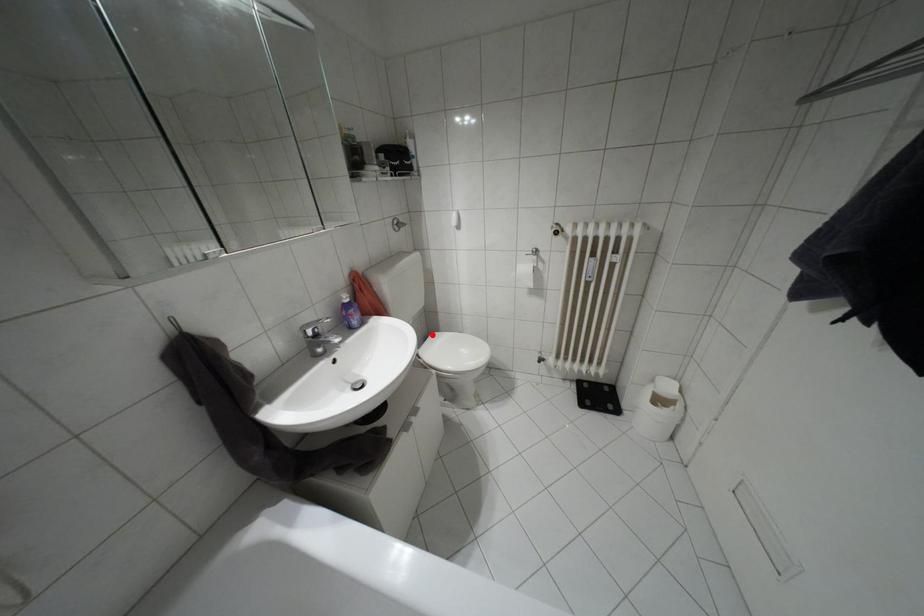
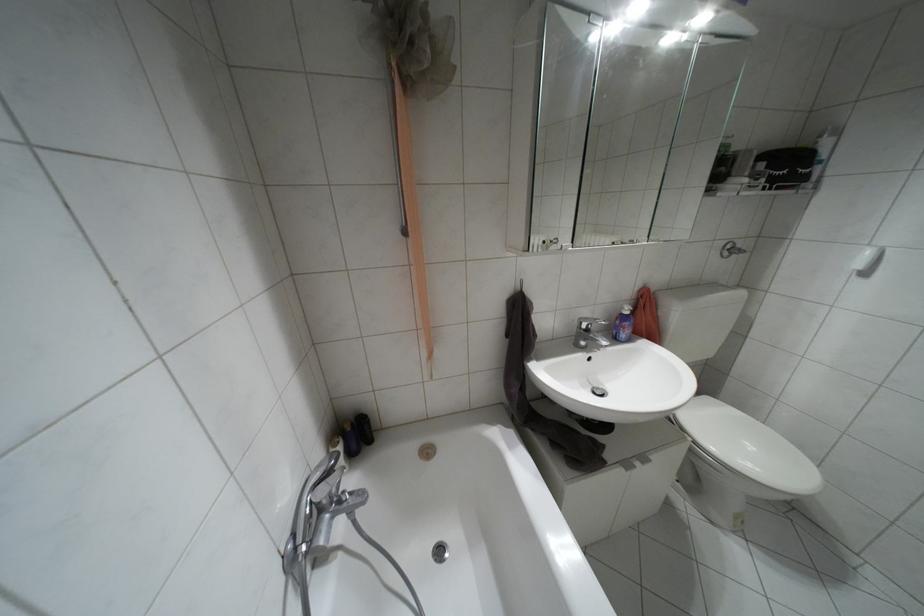
The point at the highlighted location is marked in the first image. Where is the corresponding point in the second image?

(706, 398)